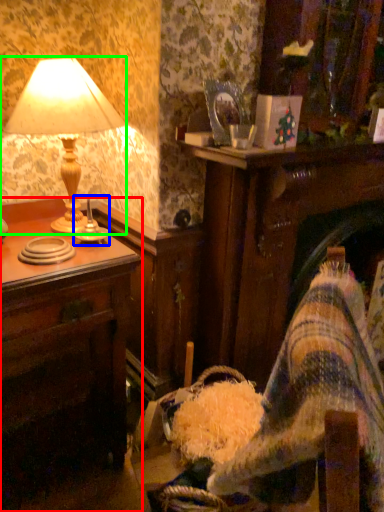
Question: Based on their relative distances, which object is nearer to desk (highlighted by a red box)? Choose from candle holder (highlighted by a blue box) and lamp (highlighted by a green box).

Choices:
 (A) candle holder
 (B) lamp

Answer: (B)